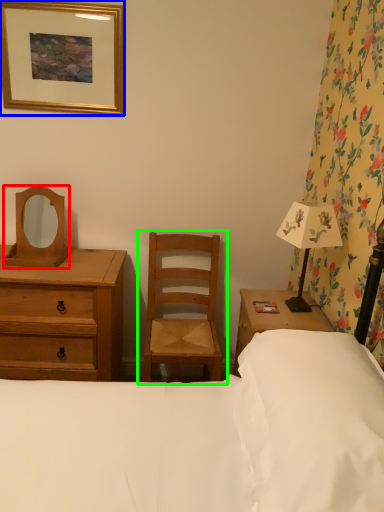
Question: Estimate the real-world distances between objects in this image. Which object is farther from mirror (highlighted by a red box), picture frame (highlighted by a blue box) or chair (highlighted by a green box)?

Choices:
 (A) picture frame
 (B) chair

Answer: (B)